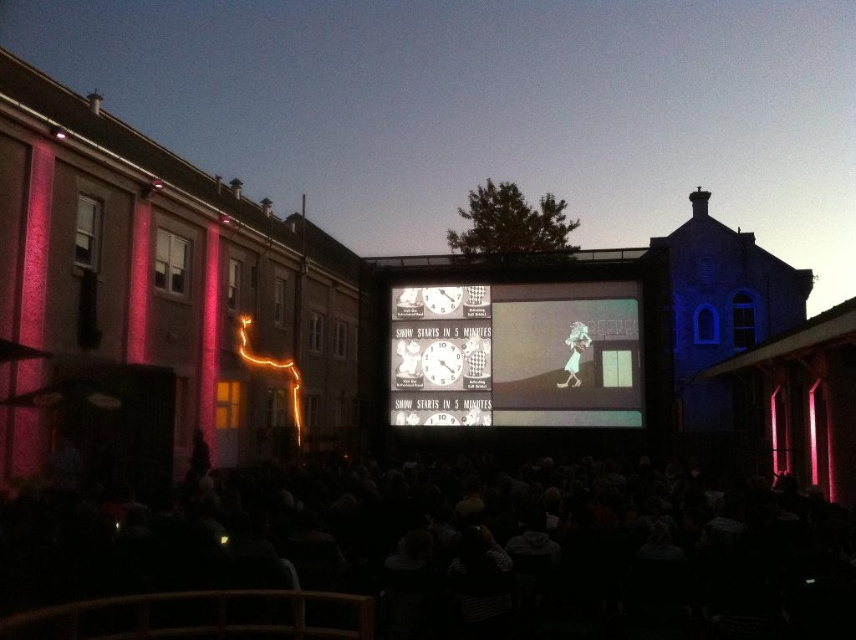
Question: Which point is farther to the camera?

Choices:
 (A) yellow neon lights at left
 (B) matte plastic screen at center

Answer: (A)

Question: Which is nearer to the black fabric crowd at center?

Choices:
 (A) yellow neon lights at left
 (B) matte plastic screen at center
 (C) smooth white dress at center
 (D) metallic silver clock at center

Answer: (B)

Question: Does black fabric crowd at center have a smaller size compared to smooth white dress at center?

Choices:
 (A) yes
 (B) no

Answer: (B)

Question: Is matte plastic screen at center positioned in front of metallic silver clock at center?

Choices:
 (A) no
 (B) yes

Answer: (B)

Question: Among these objects, which one is farthest from the camera?

Choices:
 (A) smooth white dress at center
 (B) yellow neon lights at left
 (C) metallic silver clock at center
 (D) black fabric crowd at center

Answer: (B)

Question: Is matte plastic screen at center behind metallic silver clock at center?

Choices:
 (A) no
 (B) yes

Answer: (A)